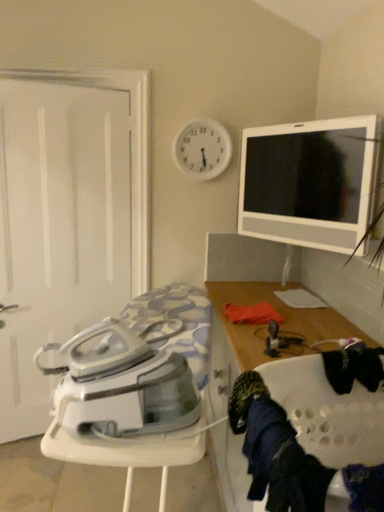
At what (x,y) coordinates should I click in order to perform the action: click on empty space that is ontop of white matte door at left (from a real-world perspective). Please return your answer as a coordinate pair (x, y). This screenshot has height=512, width=384. Looking at the image, I should click on (75, 55).